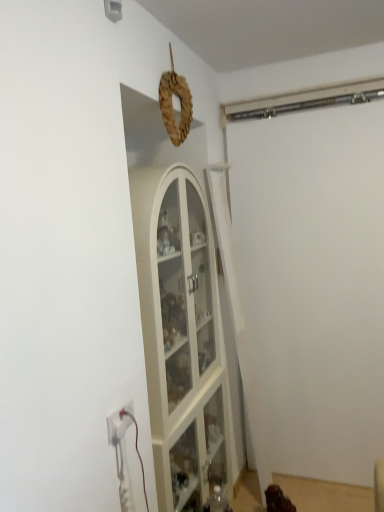
Question: In the image, is white plastic electric outlet at lower left positioned in front of or behind white matte garage door at right?

Choices:
 (A) front
 (B) behind

Answer: (A)

Question: Choose the correct answer: Is white plastic electric outlet at lower left inside white matte garage door at right or outside it?

Choices:
 (A) inside
 (B) outside

Answer: (B)

Question: Would you say white plastic electric outlet at lower left is to the left or to the right of white matte garage door at right in the picture?

Choices:
 (A) right
 (B) left

Answer: (B)

Question: Is white matte garage door at right bigger or smaller than white plastic electric outlet at lower left?

Choices:
 (A) big
 (B) small

Answer: (A)

Question: Is white matte garage door at right wider or thinner than white plastic electric outlet at lower left?

Choices:
 (A) thin
 (B) wide

Answer: (B)

Question: Is white matte garage door at right spatially inside white plastic electric outlet at lower left, or outside of it?

Choices:
 (A) inside
 (B) outside

Answer: (B)

Question: Considering their positions, is white matte garage door at right located in front of or behind white plastic electric outlet at lower left?

Choices:
 (A) front
 (B) behind

Answer: (B)